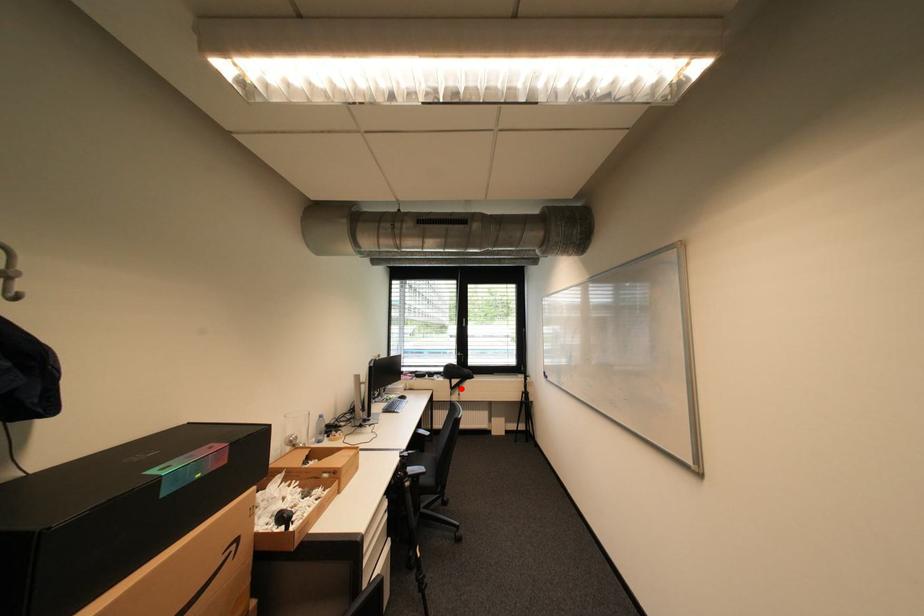
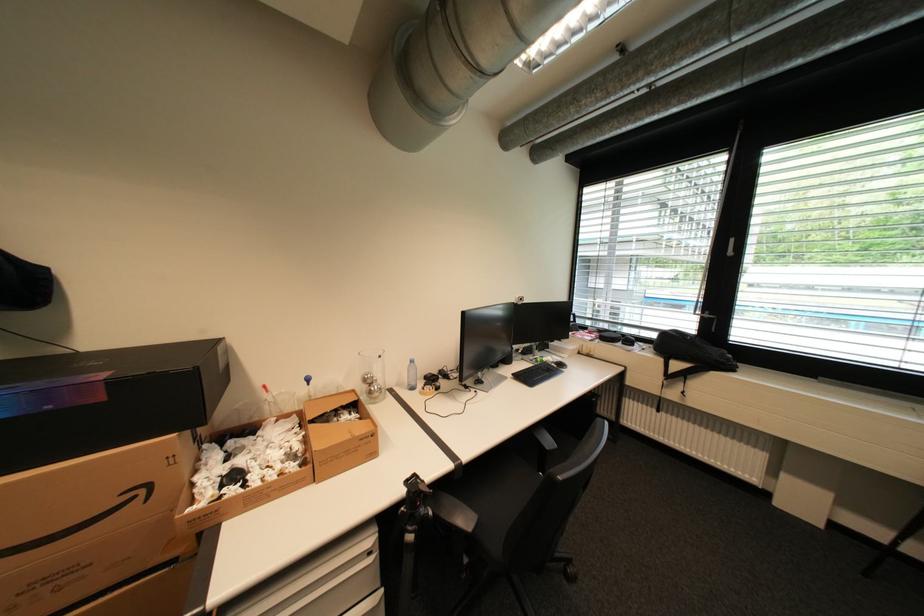
Question: A red point is marked in image1. In image2, is the corresponding 3D point closer to the camera or farther? Reply with the corresponding letter.

Choices:
 (A) The corresponding 3D point is closer.
 (B) The corresponding 3D point is farther.

Answer: (A)